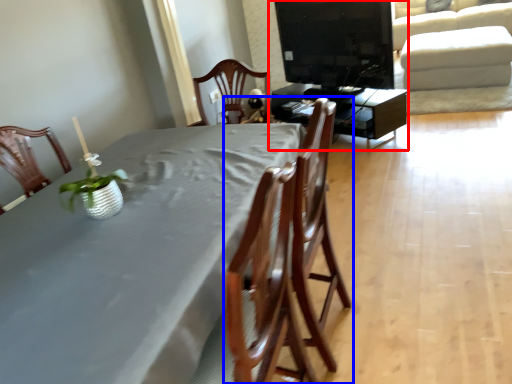
Question: Among these objects, which one is nearest to the camera, entertainment center (highlighted by a red box) or chair (highlighted by a blue box)?

Choices:
 (A) entertainment center
 (B) chair

Answer: (B)